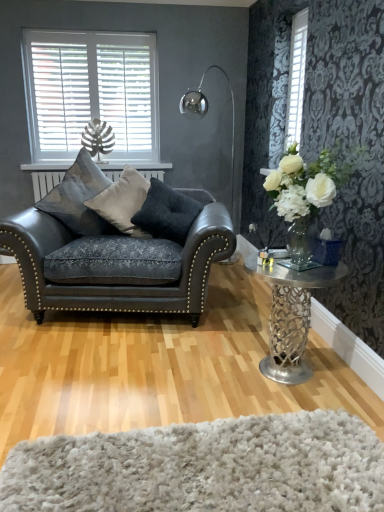
At what (x,y) coordinates should I click in order to perform the action: click on free space to the left of metallic silver table at right. Please return your answer as a coordinate pair (x, y). The image size is (384, 512). Looking at the image, I should click on (195, 369).